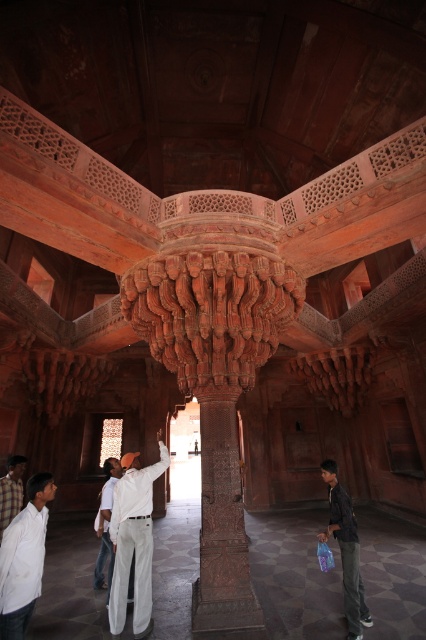
Does white cotton pants at center have a smaller size compared to light brown fabric shirt at center?

No, white cotton pants at center is not smaller than light brown fabric shirt at center.

What do you see at coordinates (134, 540) in the screenshot? This screenshot has width=426, height=640. I see `white cotton pants at center` at bounding box center [134, 540].

This screenshot has height=640, width=426. In order to click on white cotton pants at center in this screenshot , I will do `click(134, 540)`.

From the picture: Can you confirm if white cotton pants at center is thinner than dark gray jeans at lower right?

No.

The image size is (426, 640). I want to click on white cotton pants at center, so click(134, 540).

Where is `white cotton pants at center`? white cotton pants at center is located at coordinates (134, 540).

Consider the image. Does white cotton pants at center have a lesser width compared to white matte shirt at center?

In fact, white cotton pants at center might be wider than white matte shirt at center.

From the picture: Does white cotton pants at center have a greater width compared to white matte shirt at center?

Yes.

You are a GUI agent. You are given a task and a screenshot of the screen. Output one action in this format:
    pyautogui.click(x=<x>, y=<y>)
    Task: Click on the white cotton pants at center
    This screenshot has width=426, height=640.
    Given the screenshot: What is the action you would take?
    pyautogui.click(x=134, y=540)